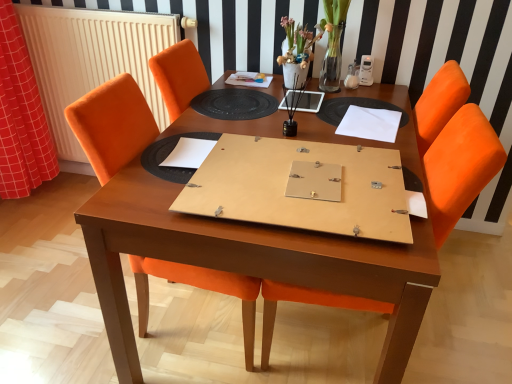
Find the location of a particular element. The width and height of the screenshot is (512, 384). free spot to the left of white paper at upper right, which is the 1th notebook in top-to-bottom order is located at coordinates (302, 125).